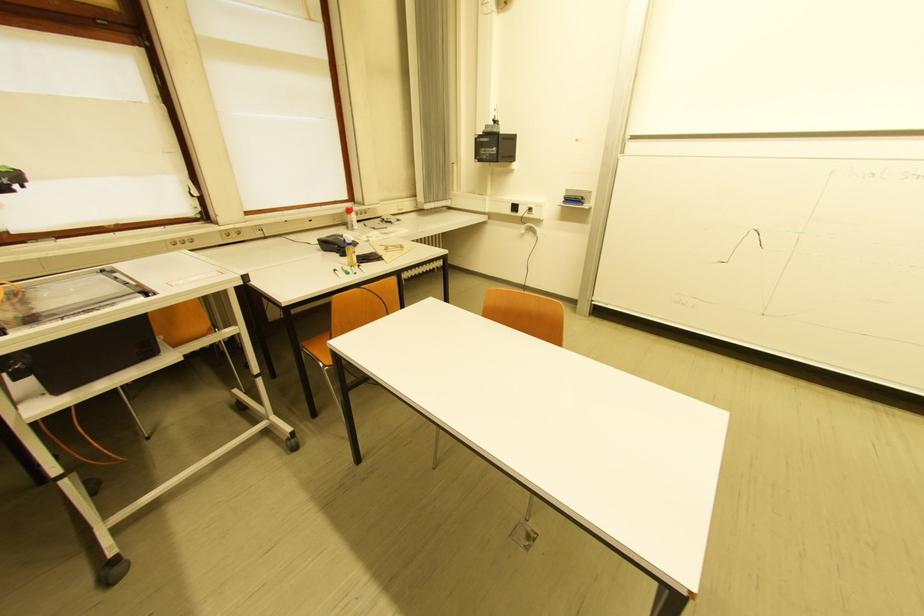
Where would you lift the whiteboard eraser? Please return your answer as a coordinate pair (x, y).

(576, 198)